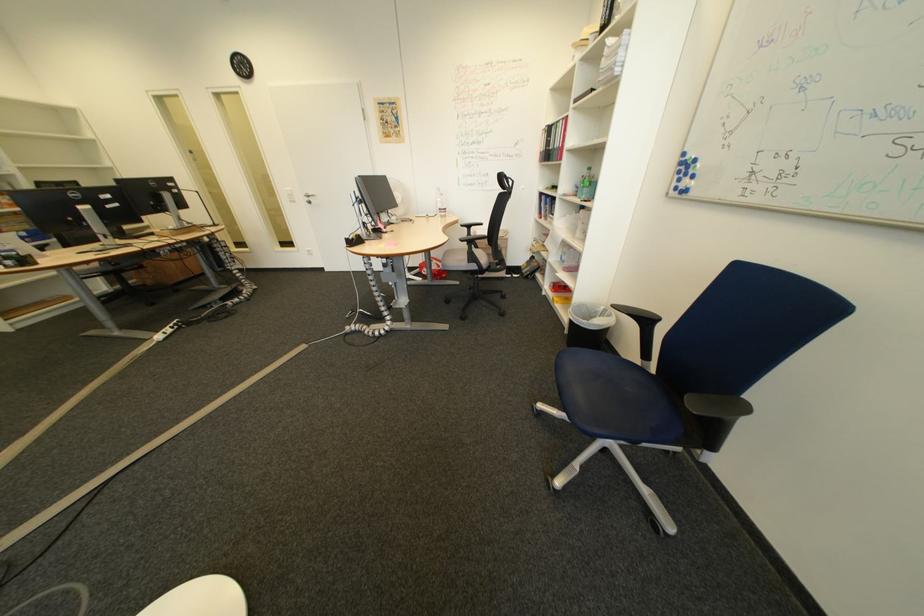
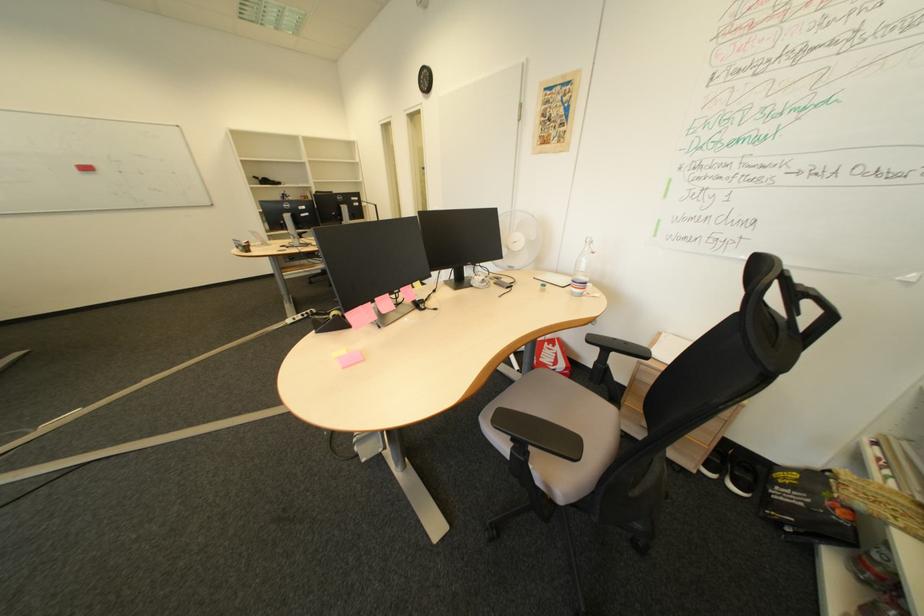
Locate, in the second image, the point that corresponds to point (453, 211) in the first image.

(587, 282)